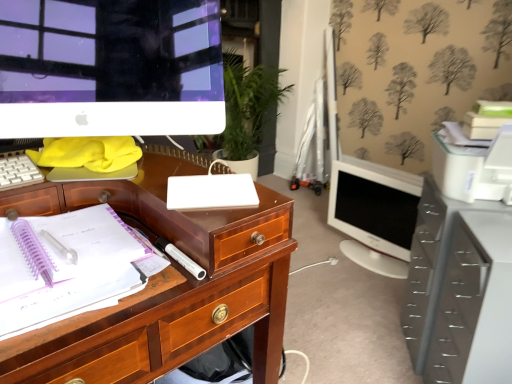
Question: Is point (19, 167) positioned closer to the camera than point (12, 329)?

Choices:
 (A) farther
 (B) closer

Answer: (A)

Question: In terms of height, does white plastic keyboard at left look taller or shorter compared to translucent plastic pen at left, marked as the 1th office supplies in a left-to-right arrangement?

Choices:
 (A) short
 (B) tall

Answer: (A)

Question: Which is farther from the white glossy monitor at center right, which is the 1th computer monitor from right to left?

Choices:
 (A) white glossy computer monitor at upper left, which ranks as the second computer monitor in right-to-left order
 (B) white matte notebook at center, the first office supplies when ordered from right to left
 (C) white plastic keyboard at left
 (D) translucent plastic pen at left, the second office supplies from the right
 (E) metallic gray file cabinet at lower right

Answer: (C)

Question: Which object is positioned closest to the translucent plastic pen at left, marked as the 1th office supplies in a left-to-right arrangement?

Choices:
 (A) metallic gray file cabinet at lower right
 (B) white matte notebook at center, the first office supplies when ordered from right to left
 (C) white glossy computer monitor at upper left, the 1th computer monitor positioned from the front
 (D) white plastic keyboard at left
 (E) white glossy monitor at center right, the second computer monitor in the front-to-back sequence

Answer: (B)